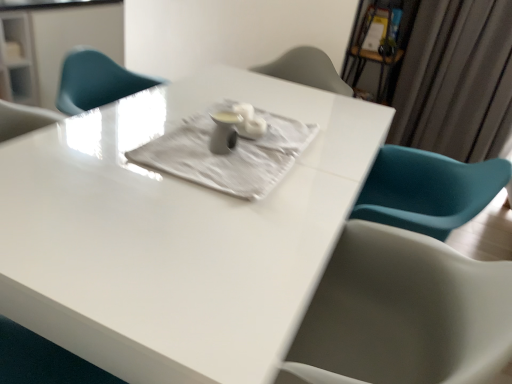
Identify the location of vacant region above white glossy table at center (from a real-world perspective). This screenshot has width=512, height=384. click(x=189, y=170).